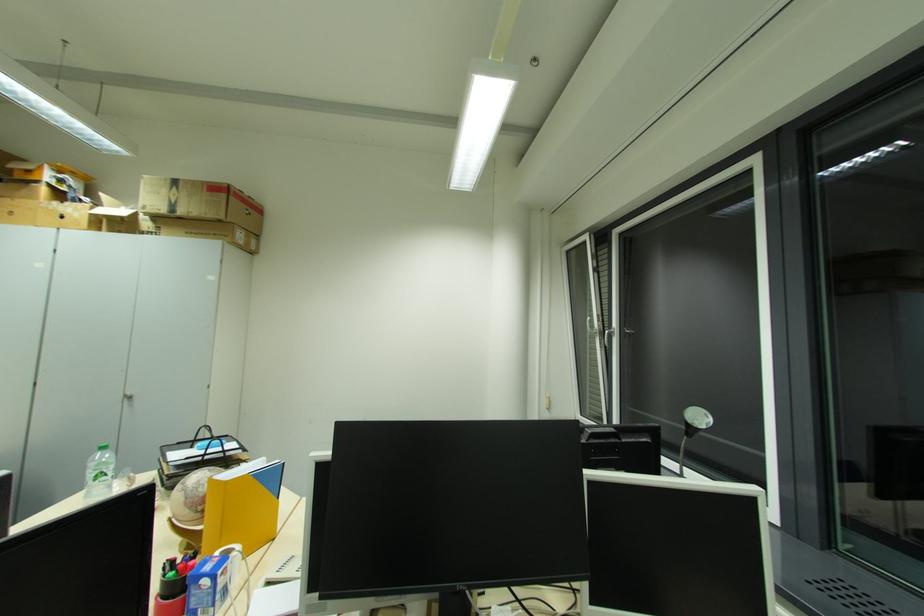
The height and width of the screenshot is (616, 924). I want to click on letter tray handle, so coord(207,440).